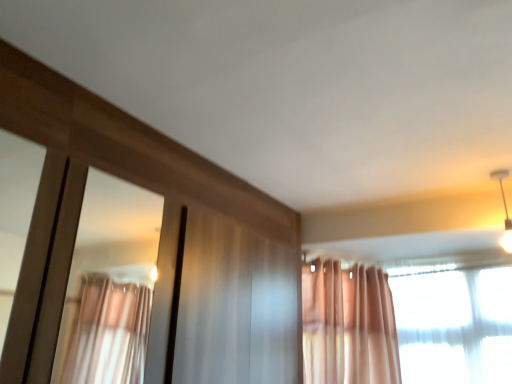
What is the approximate height of white glossy light fixture at upper right?

white glossy light fixture at upper right is 14.62 inches in height.

Describe the element at coordinates (505, 211) in the screenshot. I see `white glossy light fixture at upper right` at that location.

The height and width of the screenshot is (384, 512). What are the coordinates of `white glossy light fixture at upper right` in the screenshot? It's located at (505, 211).

Measure the distance between point [316,281] and camera.

Point [316,281] is 9.17 feet from camera.

Describe the element at coordinates (407, 325) in the screenshot. I see `translucent fabric curtain at upper right` at that location.

What is the approximate width of translucent fabric curtain at upper right?

translucent fabric curtain at upper right is 1.25 centimeters wide.

Locate an element on the screen. translucent fabric curtain at upper right is located at coordinates (407, 325).

Find the location of a particular element. The image size is (512, 384). white glossy light fixture at upper right is located at coordinates (505, 211).

Between translucent fabric curtain at upper right and white glossy light fixture at upper right, which one appears on the left side from the viewer's perspective?

From the viewer's perspective, translucent fabric curtain at upper right appears more on the left side.

Which object is further away from the camera taking this photo, translucent fabric curtain at upper right or white glossy light fixture at upper right?

white glossy light fixture at upper right.

Which is in front, point (307, 323) or point (511, 251)?

The point (511, 251) is in front.

Looking at this image, from the image's perspective, which object appears higher, translucent fabric curtain at upper right or white glossy light fixture at upper right?

white glossy light fixture at upper right, from the image's perspective.

From a real-world perspective, is translucent fabric curtain at upper right physically above white glossy light fixture at upper right?

No, from a real-world perspective, translucent fabric curtain at upper right is not on top of white glossy light fixture at upper right.

Is translucent fabric curtain at upper right thinner than white glossy light fixture at upper right?

Indeed, translucent fabric curtain at upper right has a lesser width compared to white glossy light fixture at upper right.

Is translucent fabric curtain at upper right shorter than white glossy light fixture at upper right?

Incorrect, the height of translucent fabric curtain at upper right does not fall short of that of white glossy light fixture at upper right.

Can you confirm if translucent fabric curtain at upper right is bigger than white glossy light fixture at upper right?

Yes, translucent fabric curtain at upper right is bigger than white glossy light fixture at upper right.

Looking at this image, is translucent fabric curtain at upper right located outside white glossy light fixture at upper right?

Indeed, translucent fabric curtain at upper right is completely outside white glossy light fixture at upper right.

Is translucent fabric curtain at upper right far from white glossy light fixture at upper right?

No, translucent fabric curtain at upper right is not far away from white glossy light fixture at upper right.

Could you tell me if translucent fabric curtain at upper right is facing white glossy light fixture at upper right?

Yes, translucent fabric curtain at upper right faces towards white glossy light fixture at upper right.

Measure the distance from translucent fabric curtain at upper right to white glossy light fixture at upper right.

translucent fabric curtain at upper right is 31.20 inches away from white glossy light fixture at upper right.

You are a GUI agent. You are given a task and a screenshot of the screen. Output one action in this format:
    pyautogui.click(x=<x>, y=<y>)
    Task: Click on the light fixture behind the translucent fabric curtain at upper right
    Image resolution: width=512 pixels, height=384 pixels.
    Given the screenshot: What is the action you would take?
    pyautogui.click(x=505, y=211)

Between white glossy light fixture at upper right and translucent fabric curtain at upper right, which one appears on the right side from the viewer's perspective?

white glossy light fixture at upper right.

Which object is further away from the camera, white glossy light fixture at upper right or translucent fabric curtain at upper right?

Positioned behind is white glossy light fixture at upper right.

Which is less distant, [506,211] or [500,286]?

Point [506,211].

From the image's perspective, which one is positioned lower, white glossy light fixture at upper right or translucent fabric curtain at upper right?

translucent fabric curtain at upper right, from the image's perspective.

From a real-world perspective, which object stands above the other?

white glossy light fixture at upper right.

Is white glossy light fixture at upper right thinner than translucent fabric curtain at upper right?

No.

Which of these two, white glossy light fixture at upper right or translucent fabric curtain at upper right, stands taller?

With more height is translucent fabric curtain at upper right.

Which of these two, white glossy light fixture at upper right or translucent fabric curtain at upper right, is bigger?

With larger size is translucent fabric curtain at upper right.

Consider the image. Choose the correct answer: Is white glossy light fixture at upper right inside translucent fabric curtain at upper right or outside it?

white glossy light fixture at upper right cannot be found inside translucent fabric curtain at upper right.

Are white glossy light fixture at upper right and translucent fabric curtain at upper right far apart?

They are positioned close to each other.

Is white glossy light fixture at upper right turned away from translucent fabric curtain at upper right?

That's right, white glossy light fixture at upper right is facing away from translucent fabric curtain at upper right.

Could you measure the distance between white glossy light fixture at upper right and translucent fabric curtain at upper right?

white glossy light fixture at upper right and translucent fabric curtain at upper right are 79.24 centimeters apart.

You are a GUI agent. You are given a task and a screenshot of the screen. Output one action in this format:
    pyautogui.click(x=<x>, y=<y>)
    Task: Click on the curtain below the white glossy light fixture at upper right (from a real-world perspective)
    The image size is (512, 384).
    Given the screenshot: What is the action you would take?
    click(407, 325)

The width and height of the screenshot is (512, 384). I want to click on curtain below the white glossy light fixture at upper right (from a real-world perspective), so point(407,325).

The image size is (512, 384). In order to click on curtain lying in front of the white glossy light fixture at upper right in this screenshot , I will do `click(407, 325)`.